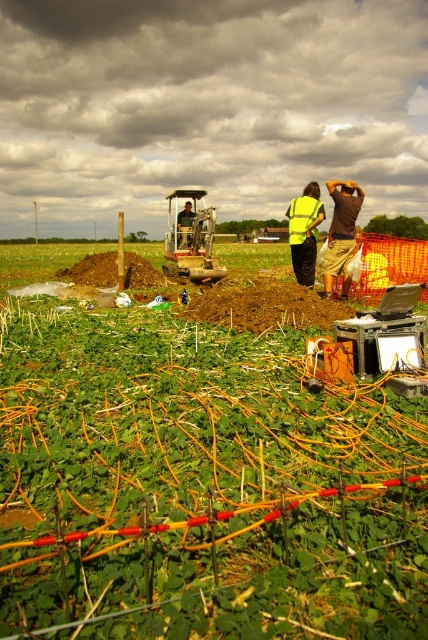
Is high visibility yellow vest at center positioned at the back of green reflective vest at center?

No, it is not.

Who is shorter, high visibility yellow vest at center or green reflective vest at center?

With less height is high visibility yellow vest at center.

Between point (318, 188) and point (187, 227), which one is positioned behind?

Point (187, 227)

What are the coordinates of `high visibility yellow vest at center` in the screenshot? It's located at (305, 232).

Does metallic yellow tractor at center have a lesser height compared to green reflective vest at center?

Yes.

In the scene shown: Between metallic yellow tractor at center and green reflective vest at center, which one is positioned higher?

metallic yellow tractor at center is higher up.

Between point (196, 204) and point (183, 236), which one is positioned behind?

Positioned behind is point (196, 204).

Locate an element on the screen. Image resolution: width=428 pixels, height=640 pixels. metallic yellow tractor at center is located at coordinates (190, 240).

Which is in front, point (35, 445) or point (207, 250)?

Point (35, 445) is more forward.

Is point (20, 568) positioned behind point (165, 253)?

No, (20, 568) is closer to viewer.

This screenshot has width=428, height=640. I want to click on green matte plant at center, so click(x=199, y=484).